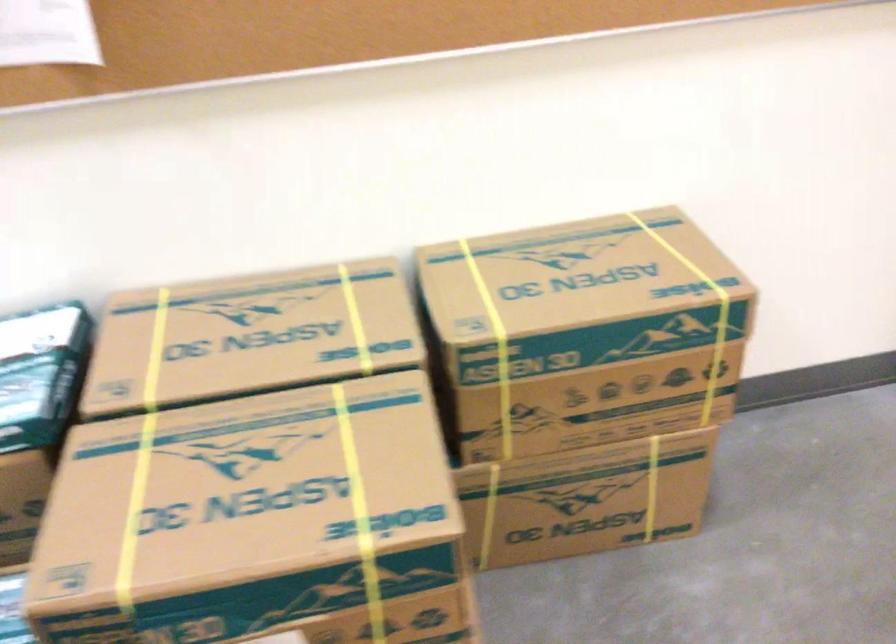
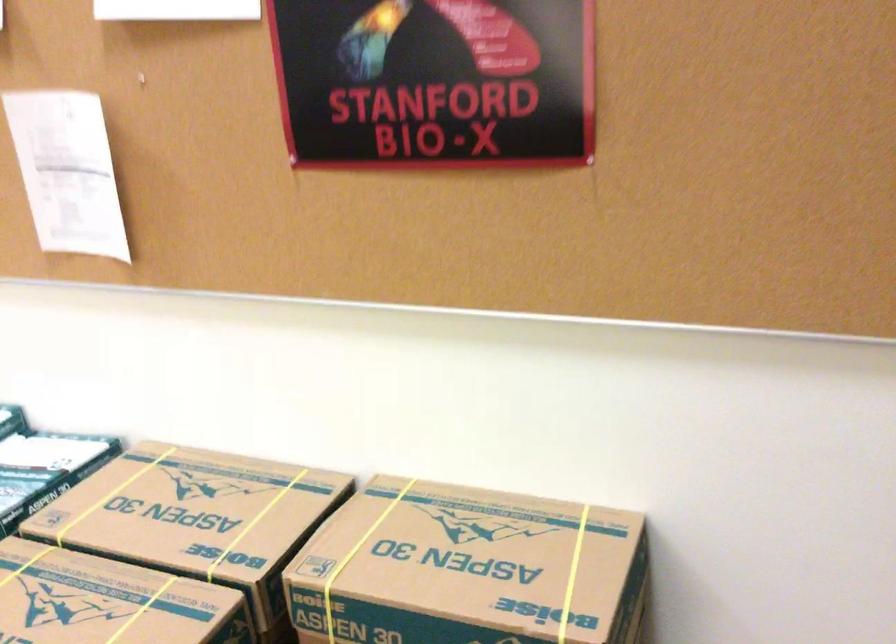
The point at (x=358, y=319) is marked in the first image. Where is the corresponding point in the second image?

(254, 523)